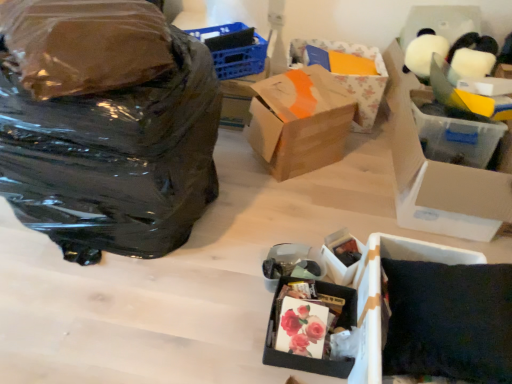
The width and height of the screenshot is (512, 384). Find the location of `vacant space that's between brown cardboard box at center, which ranks as the 2th box in top-to-bottom order, and matte black box at lower center, which appears as the first box when ordered from the bottom`. vacant space that's between brown cardboard box at center, which ranks as the 2th box in top-to-bottom order, and matte black box at lower center, which appears as the first box when ordered from the bottom is located at coordinates (295, 208).